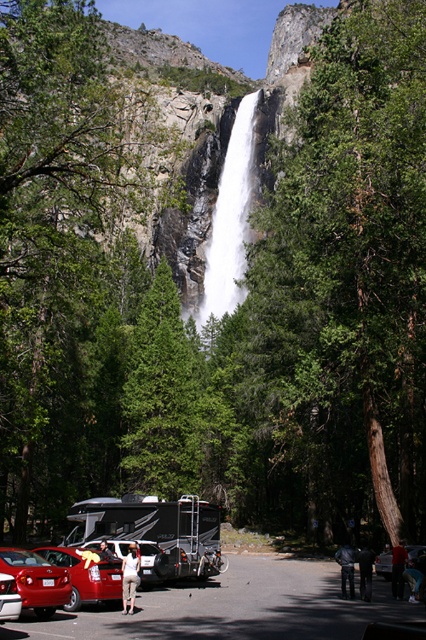
You are a photographer trying to capture a person in the scene. You notice the light blue jeans at center and the white fabric shirt at center. Which object is positioned to the right of the other?

The light blue jeans at center is to the right of the white fabric shirt at center according to the description.

You are a visitor at the waterfall parking area. You notice a green leafy tree at left and a metallic red car at lower left. Which object is above the other?

The green leafy tree at left is positioned over the metallic red car at lower left.

You are a photographer trying to capture the person in the scene. The person is wearing light blue jeans at center and white fabric shirt at center. Which clothing item should you focus on to ensure it appears larger in your photo?

The light blue jeans at center is much taller than the white fabric shirt at center, so focusing on the light blue jeans at center will make it appear larger in the photo.